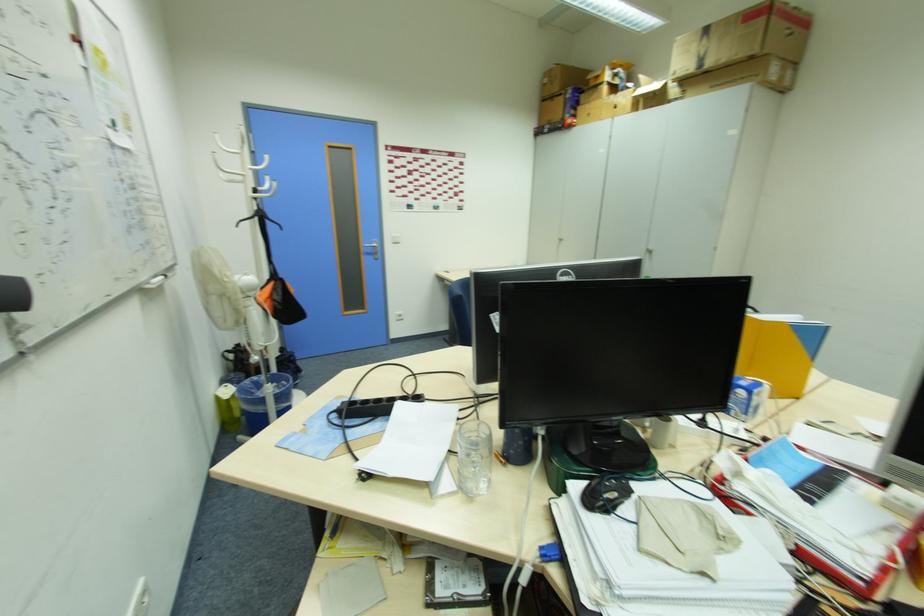
The width and height of the screenshot is (924, 616). In order to click on blue trash bin in this screenshot , I will do `click(265, 392)`.